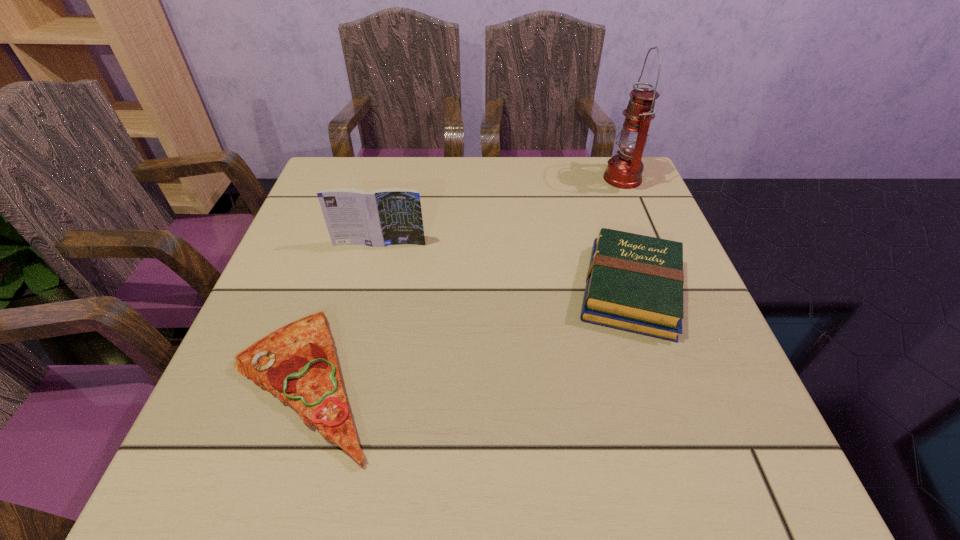
Where is `unoccupied area between the pizza and the farthest object`? unoccupied area between the pizza and the farthest object is located at coordinates (464, 280).

This screenshot has height=540, width=960. What are the coordinates of `vacant space that is in between the shortest object and the right book` in the screenshot? It's located at [468, 336].

Identify the location of vacant area between the shortest object and the second shortest object. (468, 336).

What are the coordinates of `free spot between the shortest object and the second tallest object` in the screenshot? It's located at (342, 313).

Find the location of a particular element. This screenshot has height=540, width=960. vacant region between the taller book and the second shortest object is located at coordinates (505, 267).

Locate an element on the screen. The width and height of the screenshot is (960, 540). free area in between the shortest object and the farthest object is located at coordinates (464, 280).

Identify the location of the second closest object to the left book. (634, 283).

Where is `object identified as the third closest to the tallest object`? The image size is (960, 540). object identified as the third closest to the tallest object is located at coordinates (297, 363).

Where is `free location that satisfies the following two spatial constraints: 1. on the back side of the shortest object; 2. on the left side of the third tallest object`? free location that satisfies the following two spatial constraints: 1. on the back side of the shortest object; 2. on the left side of the third tallest object is located at coordinates (334, 289).

Locate an element on the screen. The height and width of the screenshot is (540, 960). vacant space that satisfies the following two spatial constraints: 1. on the back side of the pizza; 2. on the right side of the third tallest object is located at coordinates (334, 289).